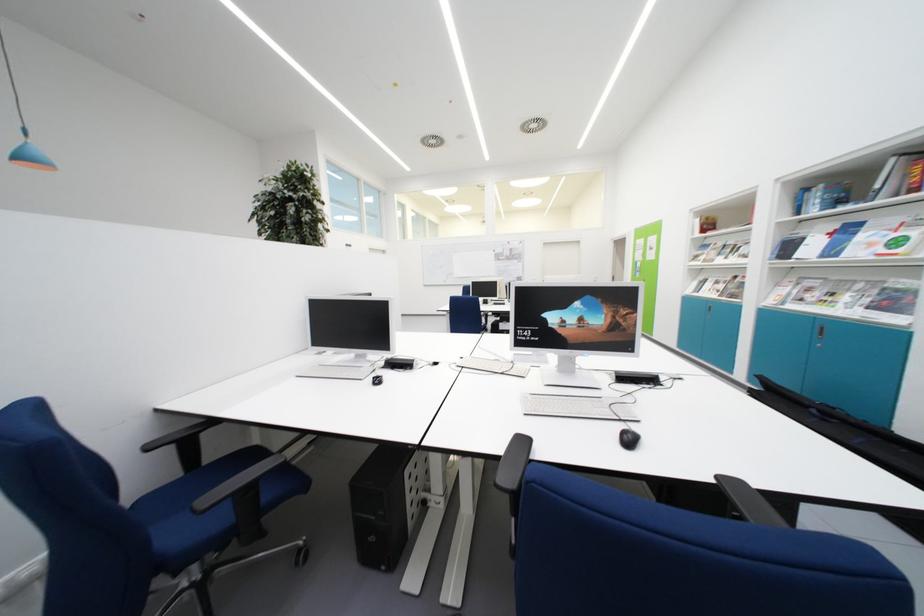
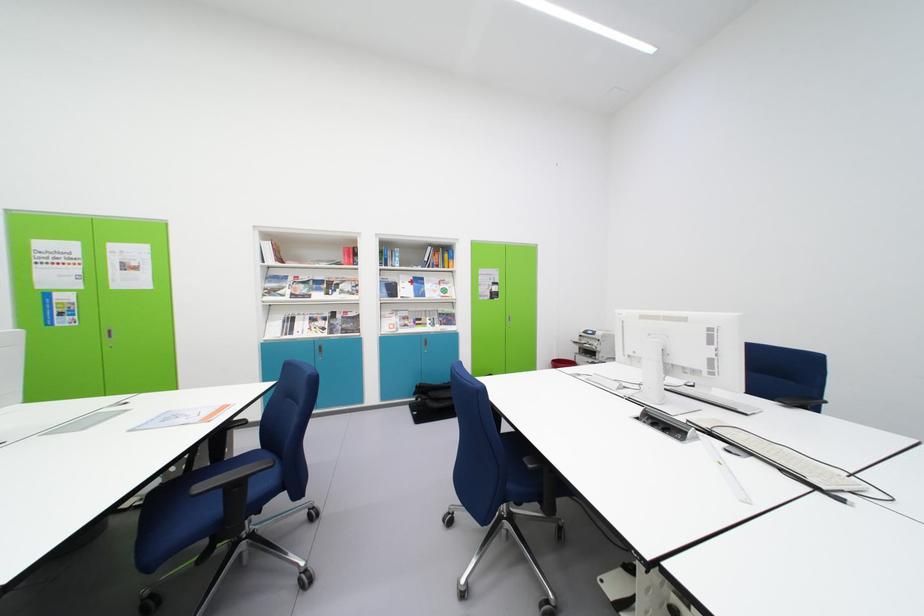
Question: I am providing you with two images of the same scene from different viewpoints. Which of the following objects are not visible in image2?

Choices:
 (A) paper document
 (B) metal clothes rod
 (C) blue chair armrest
 (D) black laptop bag

Answer: (C)